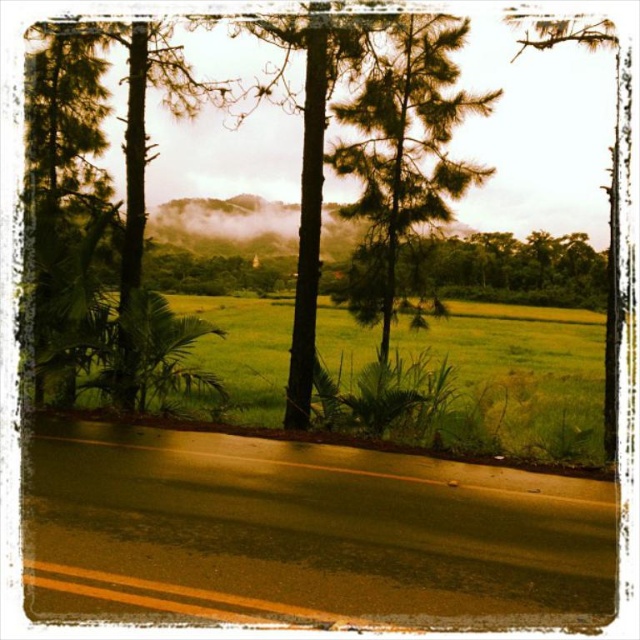
Question: Which is nearer to the green leafy tree at center?

Choices:
 (A) green matte tree at center
 (B) green grass at center

Answer: (B)

Question: Does green leafy tree at center have a larger size compared to green matte tree at center?

Choices:
 (A) yes
 (B) no

Answer: (A)

Question: Which point is closer to the camera?

Choices:
 (A) (268, 28)
 (B) (436, 307)
 (C) (237, 353)

Answer: (A)

Question: Does green leafy tree at center appear on the left side of green grass at center?

Choices:
 (A) no
 (B) yes

Answer: (B)

Question: Which of the following is the closest to the observer?

Choices:
 (A) green matte tree at center
 (B) green grass at center

Answer: (B)

Question: Can you confirm if green grass at center is wider than green matte tree at center?

Choices:
 (A) yes
 (B) no

Answer: (A)